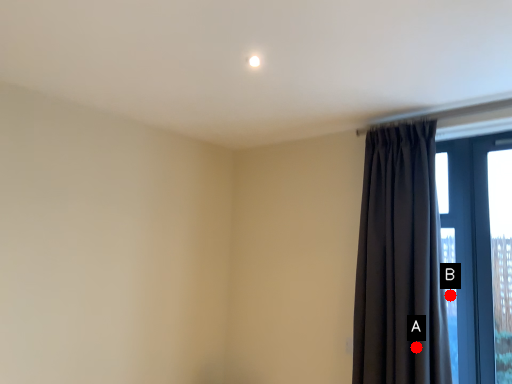
Question: Two points are circled on the image, labeled by A and B beside each circle. Which point is closer to the camera taking this photo?

Choices:
 (A) A is closer
 (B) B is closer

Answer: (A)